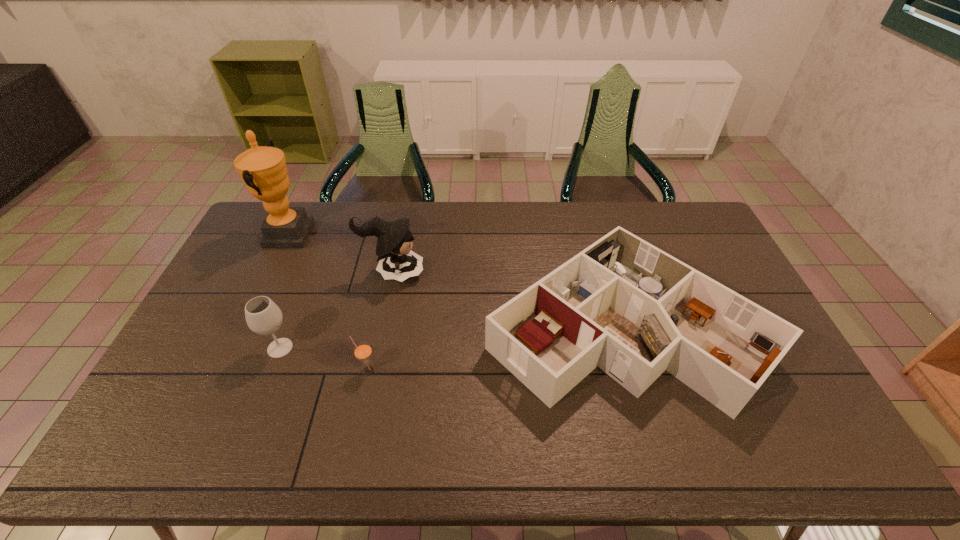
Locate an element on the screen. vacant space at the far left corner of the desktop is located at coordinates (251, 234).

Where is `blank space at the near left corner of the desktop`? blank space at the near left corner of the desktop is located at coordinates (151, 433).

This screenshot has height=540, width=960. Identify the location of vacant space at the far right corner. (695, 220).

Image resolution: width=960 pixels, height=540 pixels. I want to click on free area in between the farthest object and the straw, so click(x=327, y=302).

This screenshot has width=960, height=540. I want to click on vacant point located between the tallest object and the dollhouse, so click(455, 280).

Find the location of a particular element. The width and height of the screenshot is (960, 540). free point between the third tallest object and the straw is located at coordinates (324, 359).

Find the location of `vacant point located between the third tallest object and the doll`. vacant point located between the third tallest object and the doll is located at coordinates (336, 310).

The width and height of the screenshot is (960, 540). I want to click on vacant area that lies between the straw and the third shortest object, so click(324, 359).

Find the location of `free space between the rightmost object and the award`. free space between the rightmost object and the award is located at coordinates (455, 280).

Identify the location of blank region between the straw and the award. (327, 302).